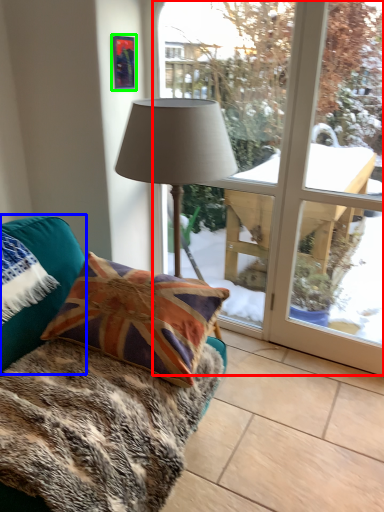
Question: Which is nearer to the bay window (highlighted by a red box)? pillow (highlighted by a blue box) or picture frame (highlighted by a green box).

Choices:
 (A) pillow
 (B) picture frame

Answer: (A)